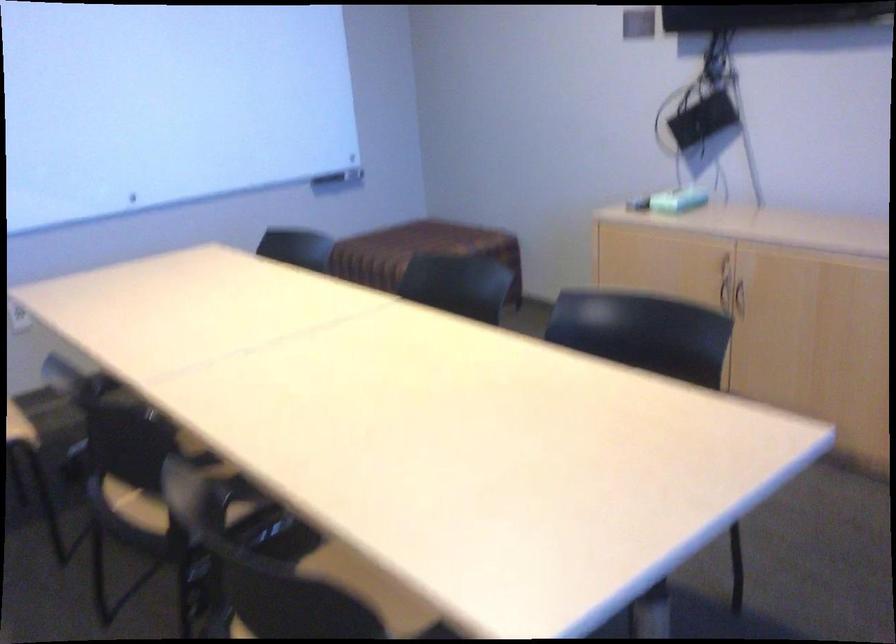
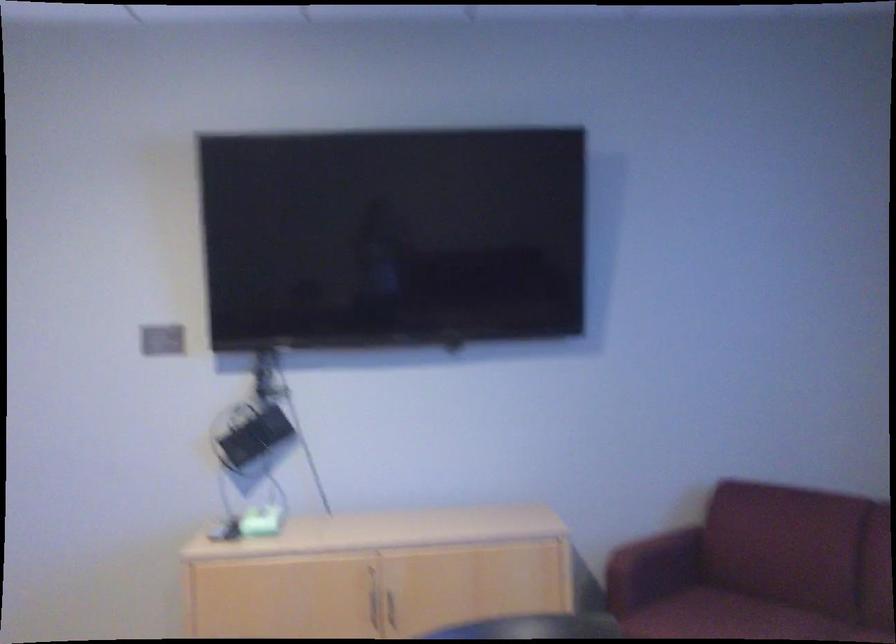
Find the pixel in the second image that matches (x=734, y=289) in the first image.

(374, 607)